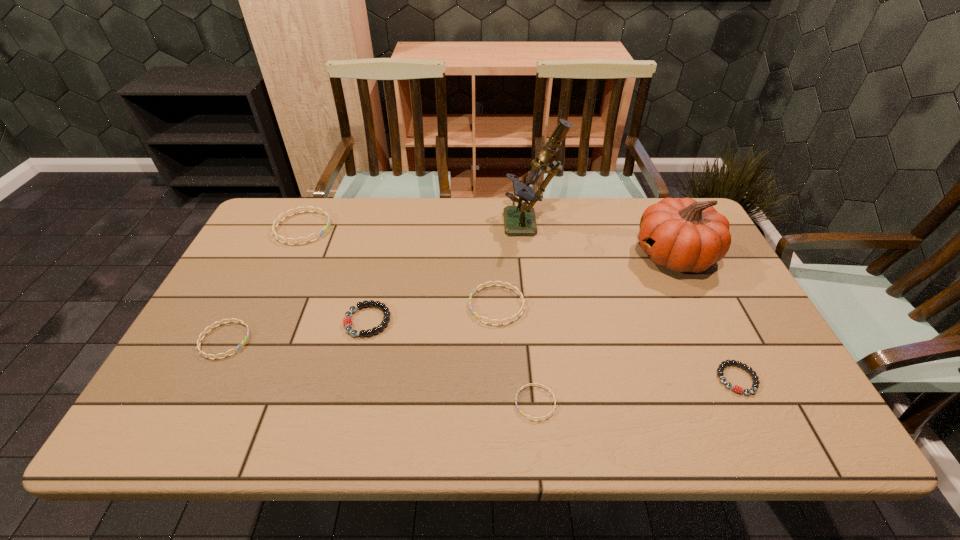
Identify the location of microscope at the far edge. This screenshot has height=540, width=960. (518, 220).

The height and width of the screenshot is (540, 960). I want to click on pumpkin present at the far edge, so click(683, 235).

Locate an element on the screen. bracelet that is at the far edge is located at coordinates (277, 237).

I want to click on object situated at the near edge, so click(x=539, y=419).

This screenshot has width=960, height=540. In order to click on pumpkin present at the right edge in this screenshot , I will do `click(683, 235)`.

I want to click on bracelet at the right edge, so click(x=720, y=369).

At what (x,y) coordinates should I click in order to perform the action: click on object that is at the far left corner. Please return your answer as a coordinate pair (x, y). The height and width of the screenshot is (540, 960). Looking at the image, I should click on (277, 237).

Find the location of a particular element. object that is at the far right corner is located at coordinates (683, 235).

Find the location of a particular element. vacant position at the far edge of the desktop is located at coordinates pos(479,204).

Where is `free region at the near edge`? Image resolution: width=960 pixels, height=540 pixels. free region at the near edge is located at coordinates (241, 433).